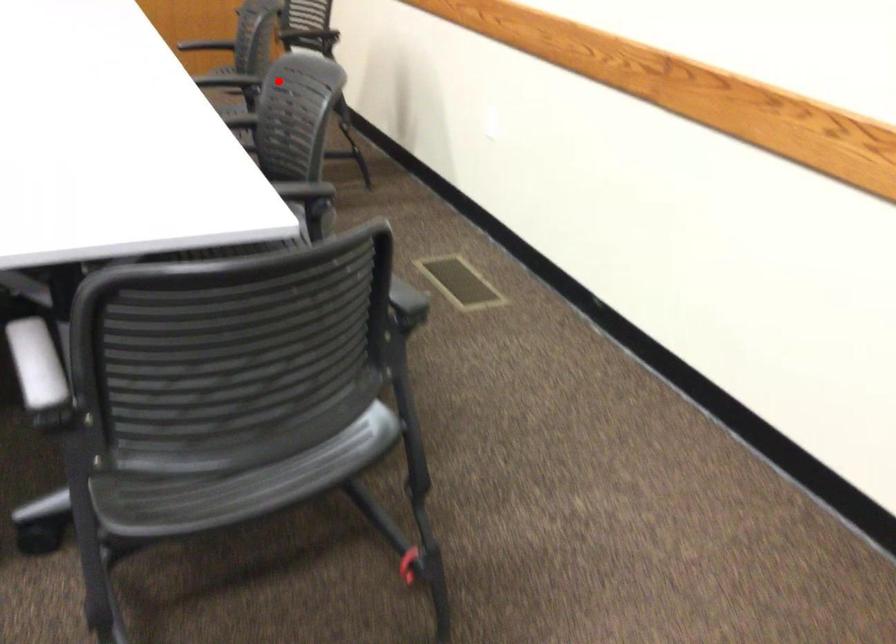
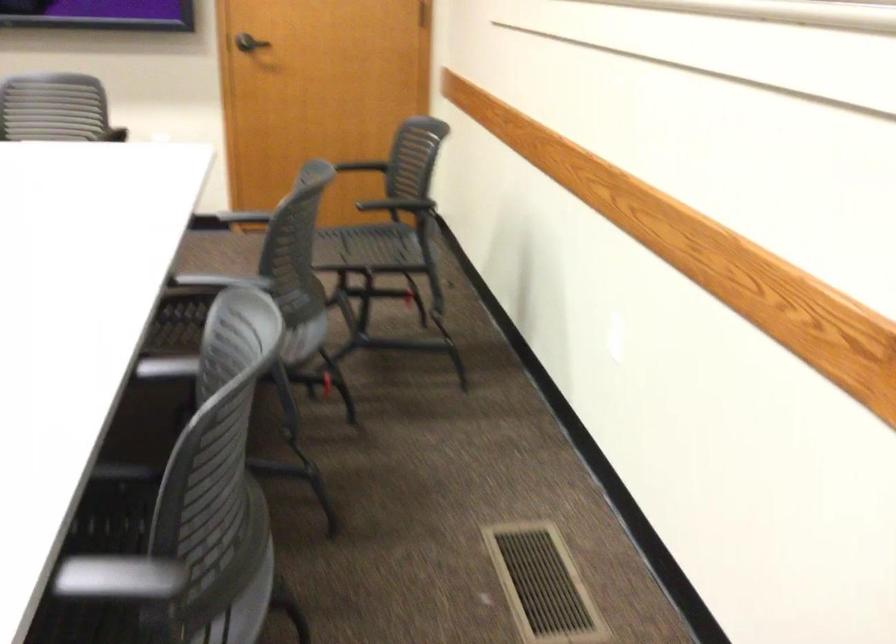
Question: A red point is marked in image1. In image2, is the corresponding 3D point closer to the camera or farther? Reply with the corresponding letter.

Choices:
 (A) The corresponding 3D point is closer.
 (B) The corresponding 3D point is farther.

Answer: (A)